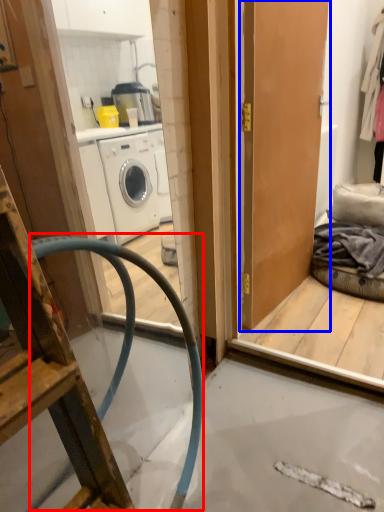
Question: Which object is closer to the camera taking this photo, garden hose (highlighted by a red box) or door (highlighted by a blue box)?

Choices:
 (A) garden hose
 (B) door

Answer: (A)